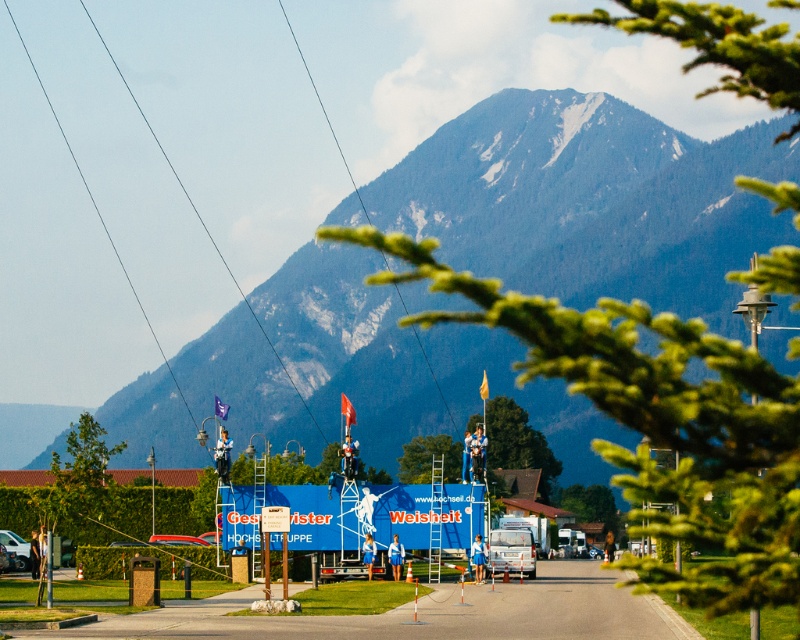
Question: Which of the following is the farthest from the observer?

Choices:
 (A) green forested mountain at upper center
 (B) metallic silver car at center

Answer: (A)

Question: Among these points, which one is farthest from the camera?

Choices:
 (A) (2, 534)
 (B) (524, 189)

Answer: (B)

Question: Considering the relative positions of green forested mountain at upper center and metallic silver car at center in the image provided, where is green forested mountain at upper center located with respect to metallic silver car at center?

Choices:
 (A) left
 (B) right

Answer: (B)

Question: Which of the following is the closest to the observer?

Choices:
 (A) (17, 538)
 (B) (494, 172)

Answer: (A)

Question: Is green forested mountain at upper center to the right of metallic silver car at center from the viewer's perspective?

Choices:
 (A) yes
 (B) no

Answer: (A)

Question: Does green forested mountain at upper center appear under metallic silver car at center?

Choices:
 (A) no
 (B) yes

Answer: (A)